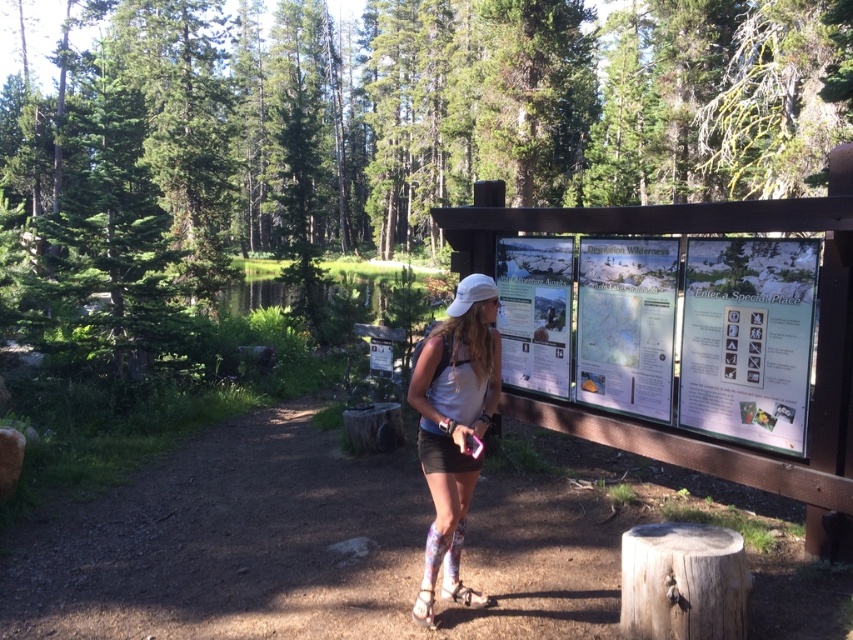
What do you see at coordinates (454, 429) in the screenshot? I see `white matte shorts at center` at bounding box center [454, 429].

In the scene shown: Which is above, white matte shorts at center or wooden stump at lower right?

Positioned higher is white matte shorts at center.

The width and height of the screenshot is (853, 640). Describe the element at coordinates (454, 429) in the screenshot. I see `white matte shorts at center` at that location.

Identify the location of white matte shorts at center. (454, 429).